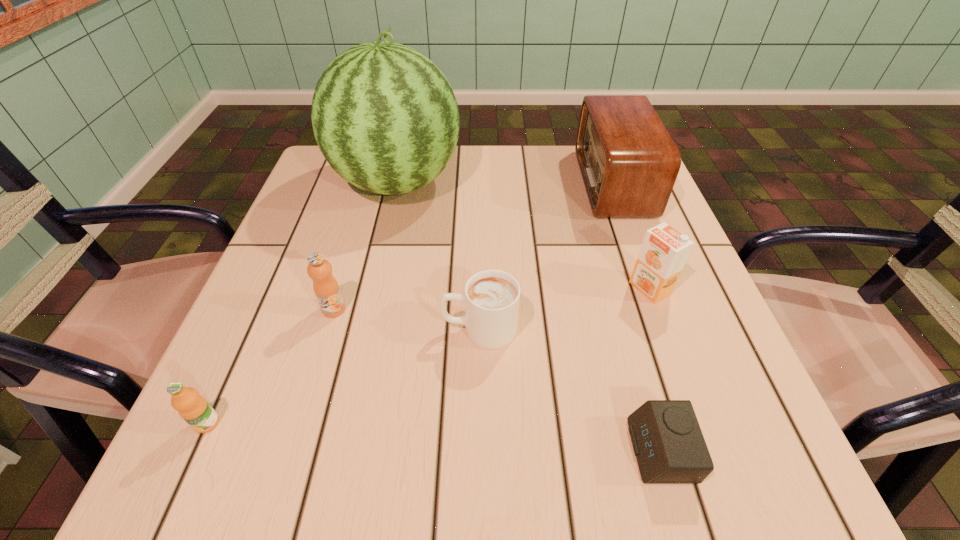
The width and height of the screenshot is (960, 540). I want to click on vacant space in between the second orange juice from left to right and the shortest object, so click(x=497, y=380).

I want to click on free point between the cappuccino and the second orange juice from left to right, so click(407, 319).

The image size is (960, 540). I want to click on free spot between the rightmost orange juice and the radio receiver, so click(632, 235).

Where is `free spot between the shortest object and the radio receiver`? free spot between the shortest object and the radio receiver is located at coordinates (636, 317).

You are a GUI agent. You are given a task and a screenshot of the screen. Output one action in this format:
    pyautogui.click(x=<x>, y=<y>)
    Task: Click on the vacant space that's between the rightmost orange juice and the shortest orange juice
    The image size is (960, 540).
    Given the screenshot: What is the action you would take?
    pyautogui.click(x=428, y=356)

This screenshot has height=540, width=960. Find the location of `vacant space that's between the shortest orange juice and the cappuccino`. vacant space that's between the shortest orange juice and the cappuccino is located at coordinates (344, 376).

Identify the location of blank region between the rightmost orange juice and the shortest object. The height and width of the screenshot is (540, 960). (655, 369).

The image size is (960, 540). Find the location of `the third closest object to the second orange juice from right to left`. the third closest object to the second orange juice from right to left is located at coordinates (384, 116).

Where is `object that is the second closest to the watermelon`? object that is the second closest to the watermelon is located at coordinates (491, 298).

Find the location of a particular element. orange juice that is the third closest to the radio receiver is located at coordinates (193, 408).